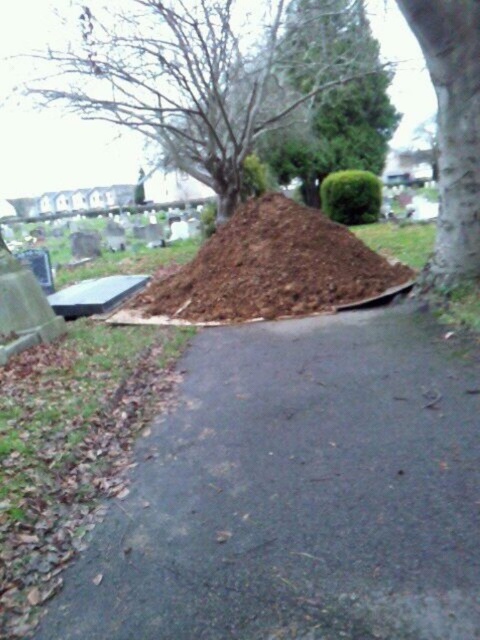
Which is above, bare branches at center or brown soil at center?

bare branches at center

Where is `bare branches at center`? This screenshot has height=640, width=480. bare branches at center is located at coordinates (204, 72).

You are a GUI agent. You are given a task and a screenshot of the screen. Output one action in this format:
    pyautogui.click(x=<x>, y=<y>)
    Task: Click on the bare branches at center
    The image size is (480, 640).
    Given the screenshot: What is the action you would take?
    pyautogui.click(x=204, y=72)

Does brown dirt at center appear on the right side of brown soil at center?

Correct, you'll find brown dirt at center to the right of brown soil at center.

Locate an element on the screen. The image size is (480, 640). brown dirt at center is located at coordinates tap(296, 493).

Between point (227, 342) and point (241, 253), which one is positioned in front?

Point (227, 342)

Where is `brown dirt at center`? This screenshot has height=640, width=480. brown dirt at center is located at coordinates [296, 493].

Measure the distance from bare branches at center to smooth bark tree at right.

The distance of bare branches at center from smooth bark tree at right is 8.10 meters.

Is bare branches at center taller than smooth bark tree at right?

Yes.

Which is behind, point (173, 54) or point (447, 237)?

Positioned behind is point (173, 54).

Where is `bare branches at center`? Image resolution: width=480 pixels, height=640 pixels. bare branches at center is located at coordinates 204,72.